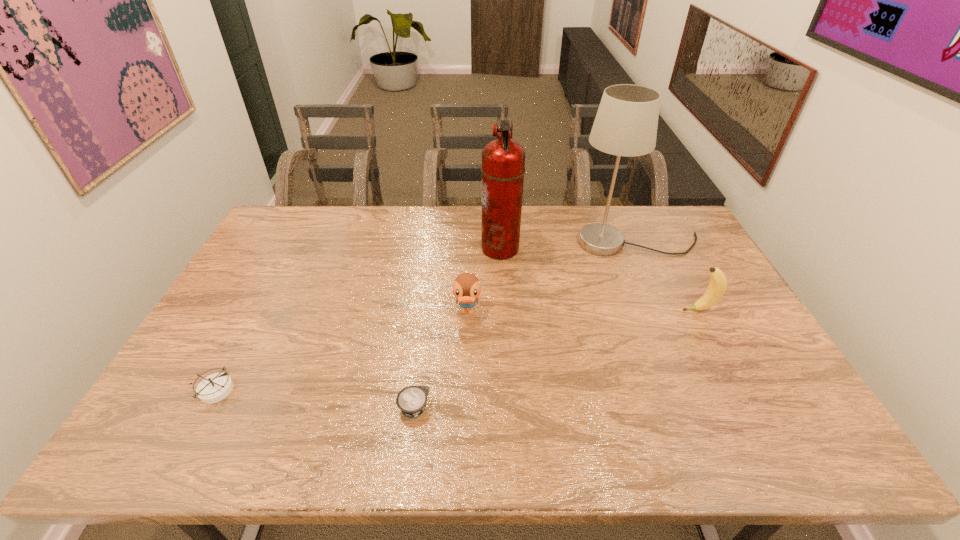
Locate an element on the screen. This screenshot has height=540, width=960. table lamp is located at coordinates (626, 122).

You are a GUI agent. You are given a task and a screenshot of the screen. Output one action in this format:
    pyautogui.click(x=<x>, y=<y>)
    Task: Click on the fire extinguisher
    
    Given the screenshot: What is the action you would take?
    pyautogui.click(x=503, y=160)

Where is `banana`? This screenshot has height=540, width=960. banana is located at coordinates (718, 283).

At what (x,y) coordinates should I click in order to perform the action: click on the fourth tallest object. Please return your answer as a coordinate pair (x, y). The height and width of the screenshot is (540, 960). Looking at the image, I should click on (466, 288).

Where is `the third object from left to right`? the third object from left to right is located at coordinates (466, 288).

Find the location of a particular element. Image resolution: width=960 pixels, height=540 pixels. the leftmost object is located at coordinates tap(214, 388).

In order to click on compass in this screenshot , I will do point(214,388).

Find the location of a particular element. The height and width of the screenshot is (540, 960). yogurt is located at coordinates (411, 400).

You are a GUI agent. You are given a task and a screenshot of the screen. Output one action in this format:
    pyautogui.click(x=<x>, y=<y>)
    Task: Click on the shortest object
    The width and height of the screenshot is (960, 540).
    Given the screenshot: What is the action you would take?
    pyautogui.click(x=411, y=400)

This screenshot has height=540, width=960. In order to click on vacant region located on the front of the table lamp in this screenshot , I will do `click(666, 308)`.